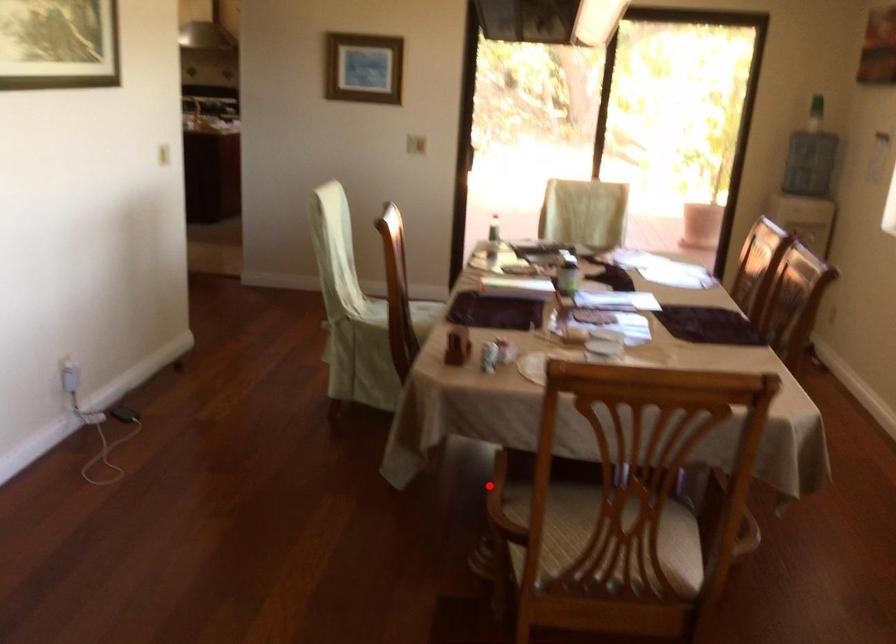
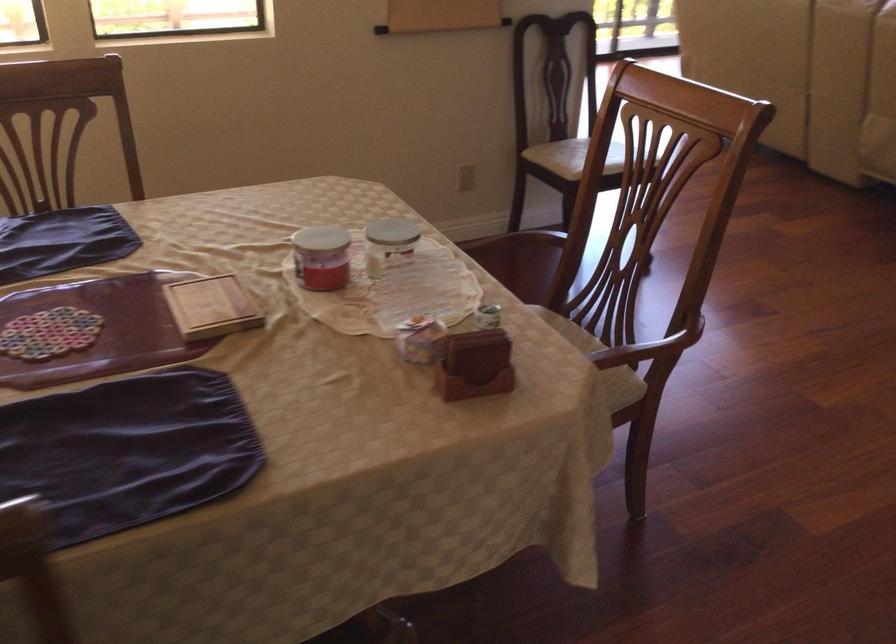
Where in the second image is the point corresponding to the highlighted location from the first image?

(642, 351)